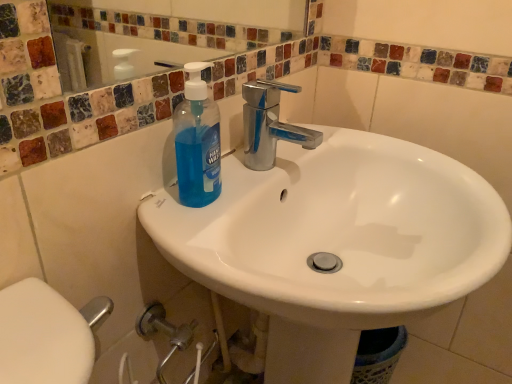
Question: From their relative heights in the image, would you say blue translucent liquid soap at center is taller or shorter than white glossy sink at center?

Choices:
 (A) tall
 (B) short

Answer: (B)

Question: From the image's perspective, is blue translucent liquid soap at center located above or below white glossy sink at center?

Choices:
 (A) above
 (B) below

Answer: (A)

Question: In terms of width, does blue translucent liquid soap at center look wider or thinner when compared to white glossy sink at center?

Choices:
 (A) wide
 (B) thin

Answer: (B)

Question: Is white glossy sink at center wider or thinner than blue translucent liquid soap at center?

Choices:
 (A) thin
 (B) wide

Answer: (B)

Question: Visually, is white glossy sink at center positioned to the left or to the right of blue translucent liquid soap at center?

Choices:
 (A) left
 (B) right

Answer: (B)

Question: In the image, is white glossy sink at center positioned in front of or behind blue translucent liquid soap at center?

Choices:
 (A) front
 (B) behind

Answer: (A)

Question: Is white glossy sink at center inside the boundaries of blue translucent liquid soap at center, or outside?

Choices:
 (A) outside
 (B) inside

Answer: (A)